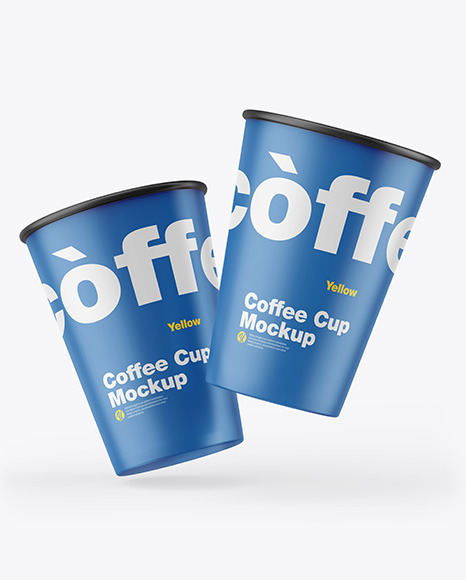
Where is `coffee cup`? coffee cup is located at coordinates (298, 380), (203, 433).